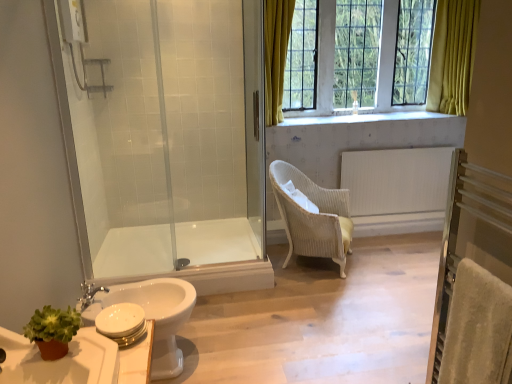
You are a GUI agent. You are given a task and a screenshot of the screen. Output one action in this format:
    pyautogui.click(x=<x>, y=<y>)
    Task: Click on the blank space above white textured radiator at center right (from a real-world perspective)
    Image resolution: width=512 pixels, height=384 pixels.
    Given the screenshot: What is the action you would take?
    pyautogui.click(x=401, y=147)